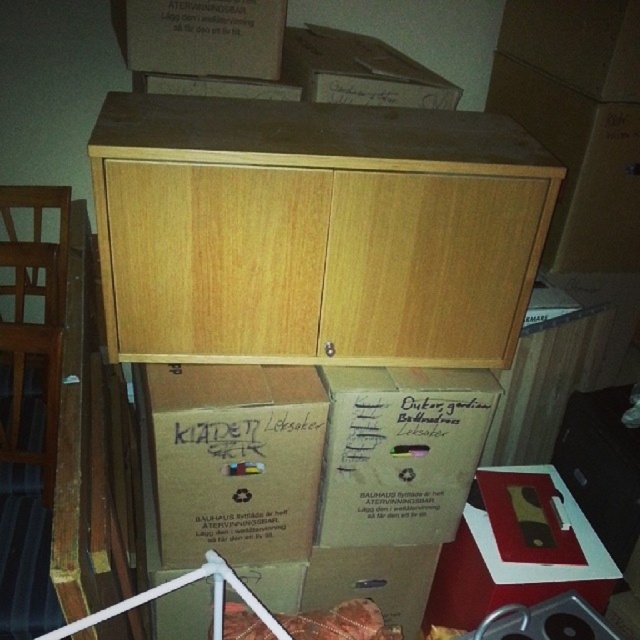
Is brown cardboard box at center smaller than brown cardboard box at lower right?

Actually, brown cardboard box at center might be larger than brown cardboard box at lower right.

Based on the photo, is brown cardboard box at center behind brown cardboard box at lower right?

No, brown cardboard box at center is closer to the viewer.

The height and width of the screenshot is (640, 640). Identify the location of brown cardboard box at center. (400, 452).

Who is higher up, brown cardboard box at center or matte cardboard box at lower right?

brown cardboard box at center is above.

Does brown cardboard box at center appear on the left side of matte cardboard box at lower right?

Indeed, brown cardboard box at center is positioned on the left side of matte cardboard box at lower right.

Where is `brown cardboard box at center`? The height and width of the screenshot is (640, 640). brown cardboard box at center is located at coordinates (400, 452).

I want to click on brown cardboard box at center, so click(400, 452).

Does light wood cabinet at upper center have a greater width compared to matte cardboard box at lower right?

Indeed, light wood cabinet at upper center has a greater width compared to matte cardboard box at lower right.

Which is more to the right, light wood cabinet at upper center or matte cardboard box at lower right?

Positioned to the right is matte cardboard box at lower right.

Is point (182, 300) positioned in front of point (428, 604)?

Yes, point (182, 300) is closer to viewer.

Identify the location of light wood cabinet at upper center. The height and width of the screenshot is (640, 640). [x=317, y=262].